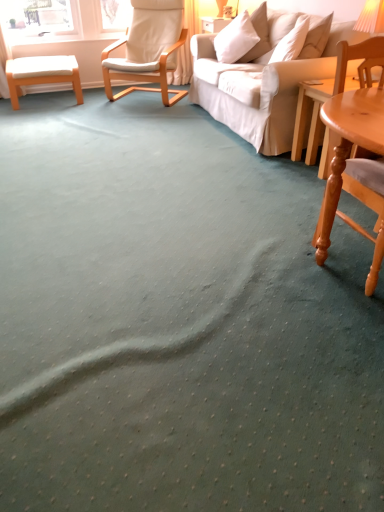
Question: From the image's perspective, is orange wood stool at left on top of light brown wooden coffee table at right?

Choices:
 (A) no
 (B) yes

Answer: (B)

Question: Is the depth of orange wood stool at left greater than that of light brown wooden coffee table at right?

Choices:
 (A) no
 (B) yes

Answer: (B)

Question: Would you say orange wood stool at left is outside light brown wooden coffee table at right?

Choices:
 (A) yes
 (B) no

Answer: (A)

Question: Considering the relative sizes of orange wood stool at left and light brown wooden coffee table at right in the image provided, is orange wood stool at left shorter than light brown wooden coffee table at right?

Choices:
 (A) no
 (B) yes

Answer: (B)

Question: Is orange wood stool at left closer to camera compared to light brown wooden coffee table at right?

Choices:
 (A) no
 (B) yes

Answer: (A)

Question: Considering the relative positions of light brown wooden coffee table at right and orange fabric lampshade at upper right in the image provided, is light brown wooden coffee table at right to the left or to the right of orange fabric lampshade at upper right?

Choices:
 (A) left
 (B) right

Answer: (A)

Question: From the image's perspective, relative to orange fabric lampshade at upper right, is light brown wooden coffee table at right above or below?

Choices:
 (A) above
 (B) below

Answer: (B)

Question: Relative to orange fabric lampshade at upper right, is light brown wooden coffee table at right in front or behind?

Choices:
 (A) front
 (B) behind

Answer: (B)

Question: Considering the positions of light brown wooden coffee table at right and orange fabric lampshade at upper right in the image, is light brown wooden coffee table at right taller or shorter than orange fabric lampshade at upper right?

Choices:
 (A) short
 (B) tall

Answer: (B)

Question: Is light wood chair at right, placed as the second chair when sorted from back to front, situated inside light brown wooden coffee table at right or outside?

Choices:
 (A) outside
 (B) inside

Answer: (A)

Question: In the image, is light wood chair at right, the 1th chair viewed from the right, on the left side or the right side of light brown wooden coffee table at right?

Choices:
 (A) right
 (B) left

Answer: (B)

Question: Does point (337, 70) appear closer or farther from the camera than point (311, 89)?

Choices:
 (A) farther
 (B) closer

Answer: (B)

Question: From a real-world perspective, is light wood chair at right, placed as the second chair when sorted from back to front, positioned above or below light brown wooden coffee table at right?

Choices:
 (A) above
 (B) below

Answer: (A)

Question: In the image, is orange fabric lampshade at upper right positioned in front of or behind orange wood stool at left?

Choices:
 (A) behind
 (B) front

Answer: (B)

Question: Which is correct: orange fabric lampshade at upper right is inside orange wood stool at left, or outside of it?

Choices:
 (A) outside
 (B) inside

Answer: (A)